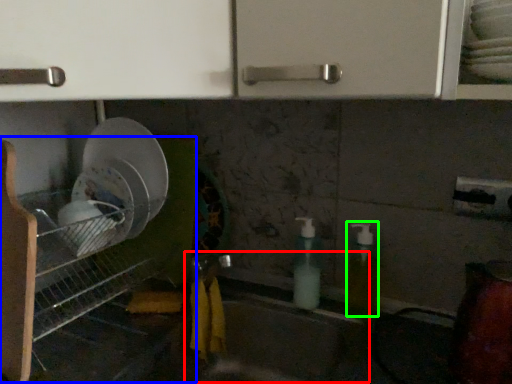
Question: Based on their relative distances, which object is nearer to sink (highlighted by a red box)? Choose from shelf (highlighted by a blue box) and soap dispenser (highlighted by a green box).

Choices:
 (A) shelf
 (B) soap dispenser

Answer: (B)